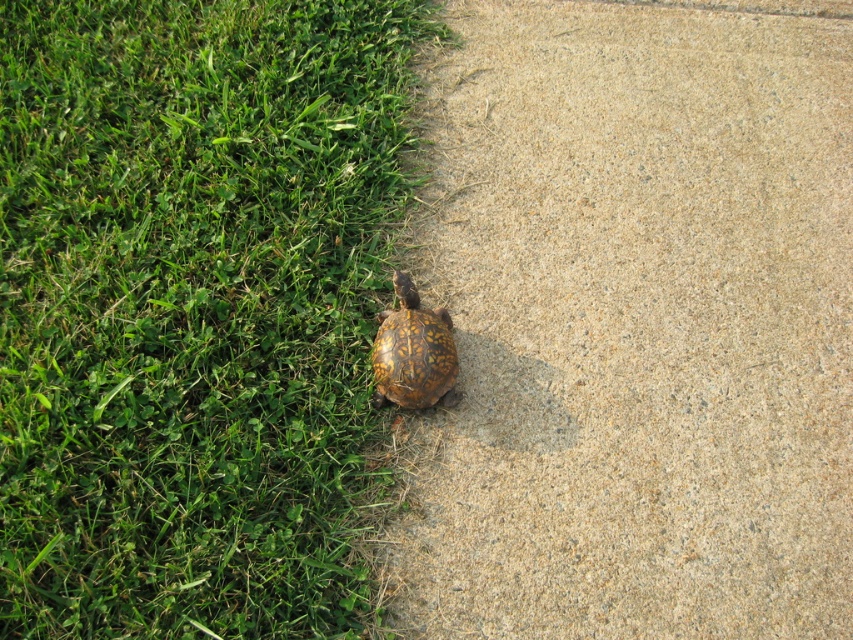
You are a gardener who needs to water the green grass at lower left and the brown textured pavement at lower left. Since you can only water one area first, which area should you prioritize based on their positions?

The green grass at lower left is behind the brown textured pavement at lower left, so you should water the brown textured pavement at lower left first to avoid getting the grass wet unnecessarily.

You are a gardener who needs to place a small decorative rock exactly at the point specified in the image. The point is located at coordinates point [192,307]. Based on the scene description, where would this point be in relation to the turtle and the concrete path?

The point [192,307] corresponds to green grass at lower left, so it is located on the grassy area to the left side of the concrete path where the turtle is walking.

You are a gardener who needs to place a new potted plant between the brown textured pavement at lower left and the brown textured shell at lower center. Based on their positions, which object should the plant be closer to?

The brown textured pavement at lower left is positioned over the brown textured shell at lower center, so the plant should be placed closer to the brown textured pavement at lower left to maintain the spatial relationship.